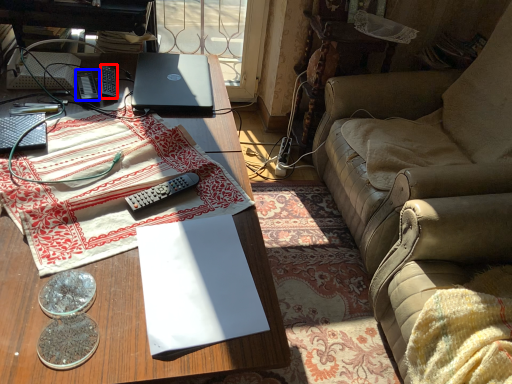
Question: Which object is closer to the camera taking this photo, remote control (highlighted by a red box) or remote control (highlighted by a blue box)?

Choices:
 (A) remote control
 (B) remote control

Answer: (B)